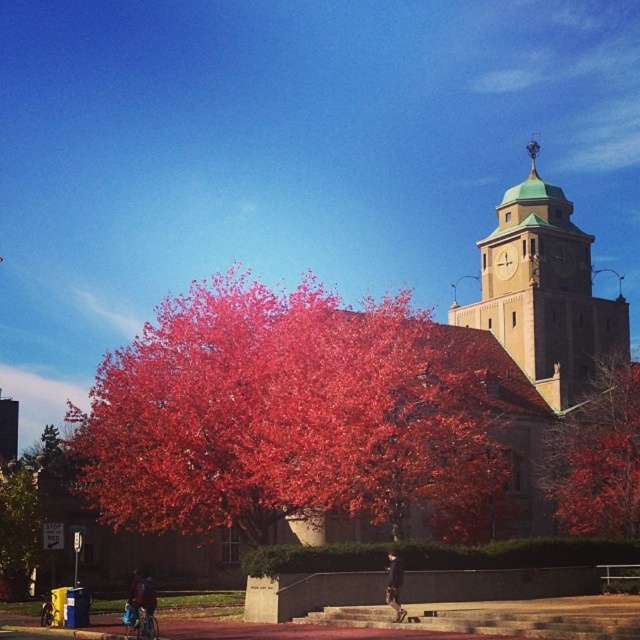
Who is positioned more to the right, green copper clock tower at upper right or smooth red tree at center?

smooth red tree at center

How much distance is there between green copper clock tower at upper right and smooth red tree at center?

green copper clock tower at upper right and smooth red tree at center are 8.01 meters apart from each other.

Locate an element on the screen. This screenshot has width=640, height=640. green copper clock tower at upper right is located at coordinates (544, 292).

This screenshot has height=640, width=640. Find the location of `green copper clock tower at upper right`. green copper clock tower at upper right is located at coordinates (544, 292).

Can you confirm if bright red leaves at center is positioned above green leafy tree at lower left?

Yes.

Is bright red leaves at center smaller than green leafy tree at lower left?

No, bright red leaves at center is not smaller than green leafy tree at lower left.

Is point (193, 288) more distant than point (10, 532)?

Yes, it is.

Find the location of a particular element. bright red leaves at center is located at coordinates (280, 413).

Find the location of `bright red leaves at center`. bright red leaves at center is located at coordinates (280, 413).

At what (x,y) coordinates should I click in order to perform the action: click on bright red leaves at center. Please return your answer as a coordinate pair (x, y). The width and height of the screenshot is (640, 640). Looking at the image, I should click on (280, 413).